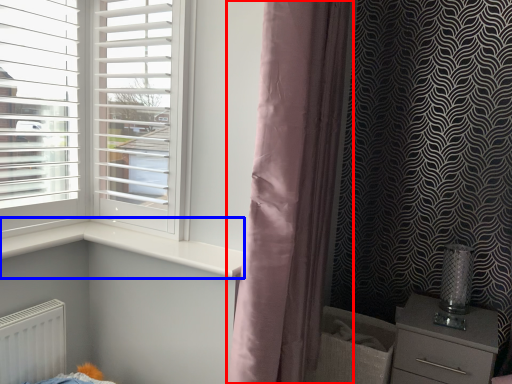
Question: Which object is further to the camera taking this photo, curtain (highlighted by a red box) or window sill (highlighted by a blue box)?

Choices:
 (A) curtain
 (B) window sill

Answer: (B)